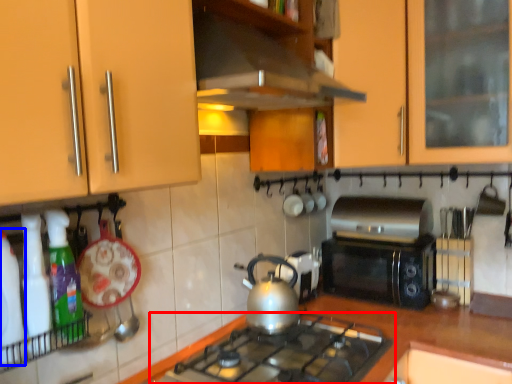
Question: Among these objects, which one is farthest to the camera, gas stove (highlighted by a red box) or bottle (highlighted by a blue box)?

Choices:
 (A) gas stove
 (B) bottle

Answer: (A)